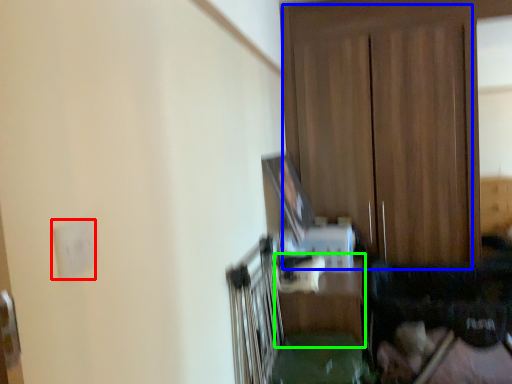
Question: Which object is positioned farthest from electric outlet (highlighted by a red box)? Select from dresser (highlighted by a blue box) and table (highlighted by a green box).

Choices:
 (A) dresser
 (B) table

Answer: (A)